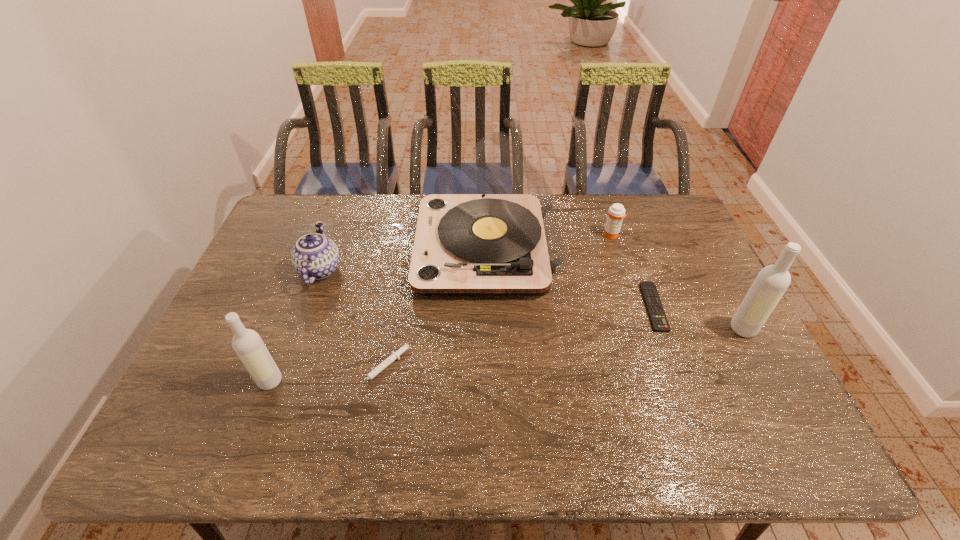
Find the location of `vacant space that's between the tallest object and the fourth shortest object`. vacant space that's between the tallest object and the fourth shortest object is located at coordinates (x=403, y=259).

Where is `vacant region between the second shortest object and the third shortest object`? vacant region between the second shortest object and the third shortest object is located at coordinates (497, 302).

This screenshot has width=960, height=540. Find the location of `empty space between the record player and the taller vodka`. empty space between the record player and the taller vodka is located at coordinates (614, 288).

You are a GUI agent. You are given a task and a screenshot of the screen. Output one action in this format:
    pyautogui.click(x=<x>, y=<y>)
    Task: Click on the unoccupied area between the tallest object and the shortest object
    The width and height of the screenshot is (960, 540).
    Given the screenshot: What is the action you would take?
    pyautogui.click(x=570, y=278)

Locate an element on the screen. The image size is (960, 540). vacant space that's between the tallest object and the nearer vodka is located at coordinates (378, 315).

Where is `vacant region between the fourth tallest object and the right vodka`? The image size is (960, 540). vacant region between the fourth tallest object and the right vodka is located at coordinates (532, 299).

Locate an element on the screen. Image resolution: width=960 pixels, height=540 pixels. unoccupied area between the right vodka and the fifth tallest object is located at coordinates (677, 282).

Where is `free space between the remote control and the fifth tallest object`? free space between the remote control and the fifth tallest object is located at coordinates (633, 271).

At what (x,y) coordinates should I click in order to perform the action: click on object that is the nearest to the medicine. Please return your answer as a coordinate pair (x, y). This screenshot has height=540, width=960. Looking at the image, I should click on (505, 241).

The height and width of the screenshot is (540, 960). I want to click on the sixth closest object to the record player, so click(x=771, y=283).